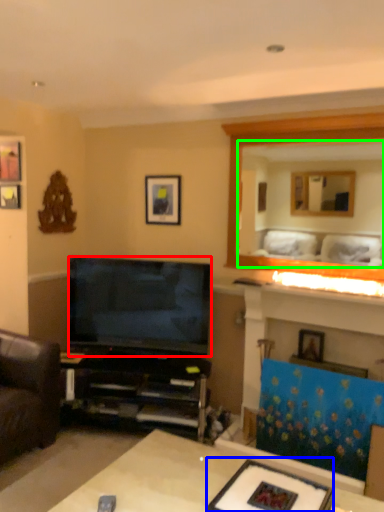
Question: Which object is the farthest from television (highlighted by a red box)? Choose among these: channel (highlighted by a blue box) or mirror (highlighted by a green box).

Choices:
 (A) channel
 (B) mirror

Answer: (B)